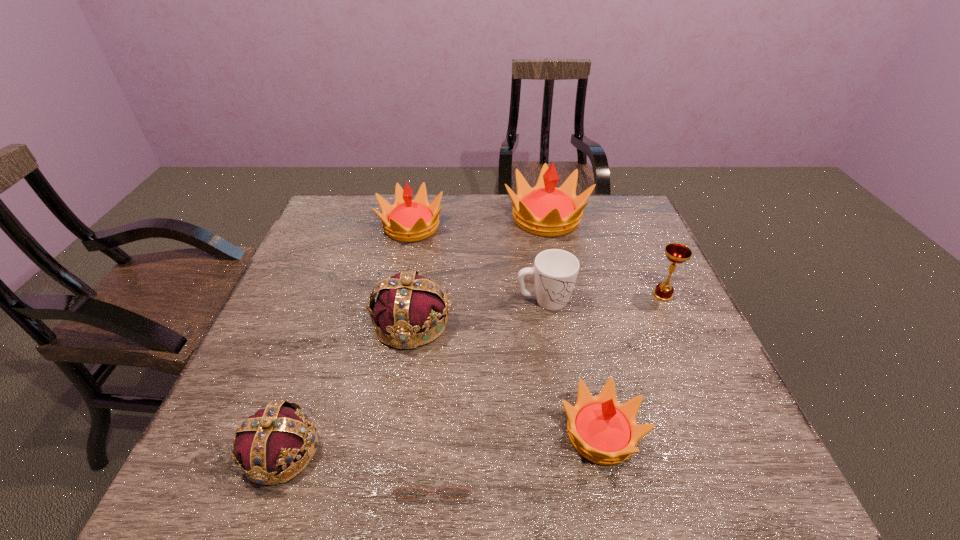
Identify the location of the tallest crown. (544, 210).

Where is `the tallest object`? The height and width of the screenshot is (540, 960). the tallest object is located at coordinates point(544,210).

At what (x,y) coordinates should I click in order to perform the action: click on the second smallest yellow crown. Please return your answer as a coordinate pair (x, y). Looking at the image, I should click on (407, 220).

Locate an element on the screen. Image resolution: width=960 pixels, height=540 pixels. the farther purple crown is located at coordinates (407, 304).

The width and height of the screenshot is (960, 540). In order to click on the bigger purple crown in this screenshot , I will do [407, 304].

The image size is (960, 540). Identify the location of the rightmost object. (676, 253).

Locate an element on the screen. mug is located at coordinates (x=555, y=271).

You are a GUI agent. You are given a task and a screenshot of the screen. Output one action in this format:
    pyautogui.click(x=<x>, y=<y>)
    Task: Click on the smallest yellow crown
    This screenshot has width=960, height=540.
    Given the screenshot: What is the action you would take?
    pyautogui.click(x=602, y=430)

Locate an element on the screen. The width and height of the screenshot is (960, 540). the smaller purple crown is located at coordinates (273, 438).

You are a GUI agent. You are given a task and a screenshot of the screen. Output one action in this format:
    pyautogui.click(x=<x>, y=<y>)
    Task: Click on the nearer purple crown
    The width and height of the screenshot is (960, 540).
    Given the screenshot: What is the action you would take?
    pyautogui.click(x=273, y=438)